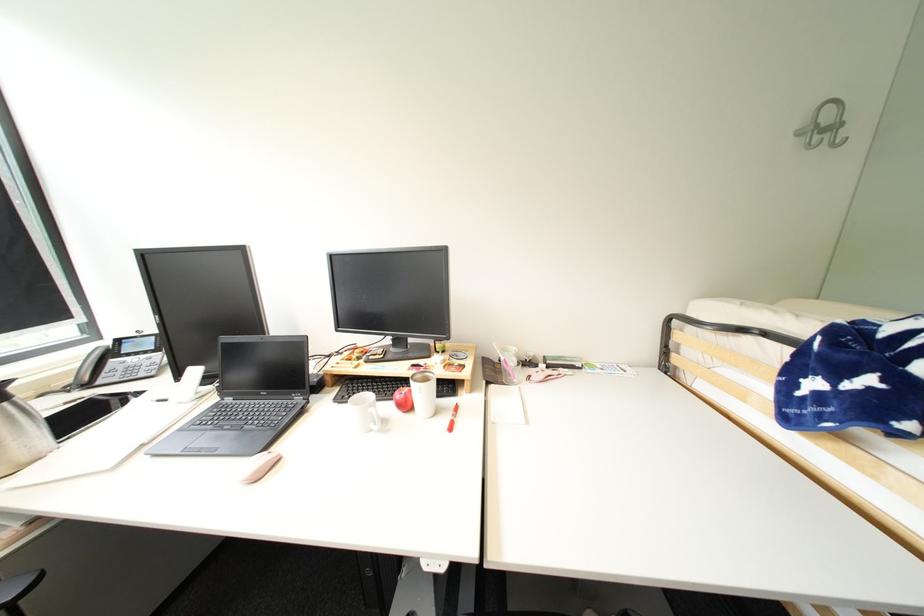
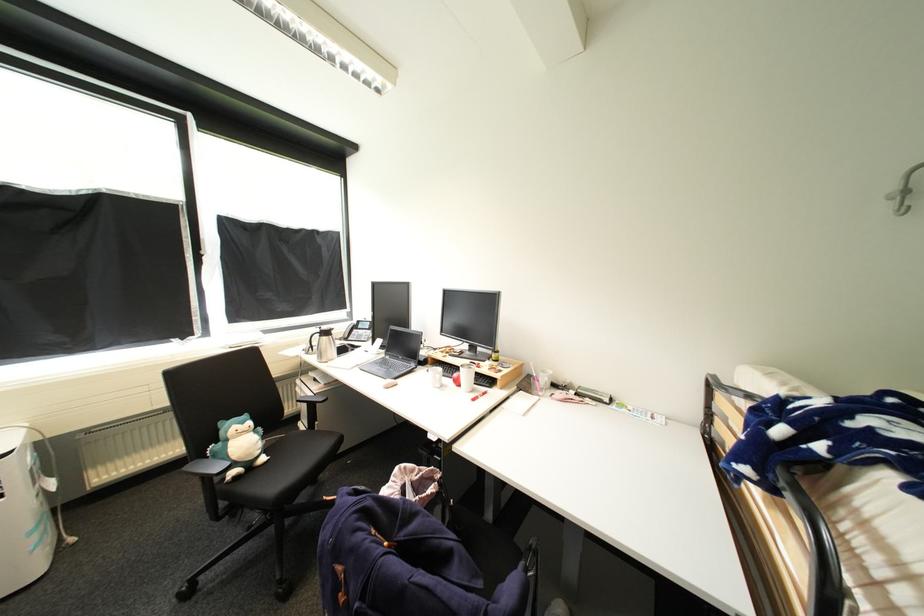
Where in the second image is the point corresponding to (148,448) from the first image?

(363, 366)